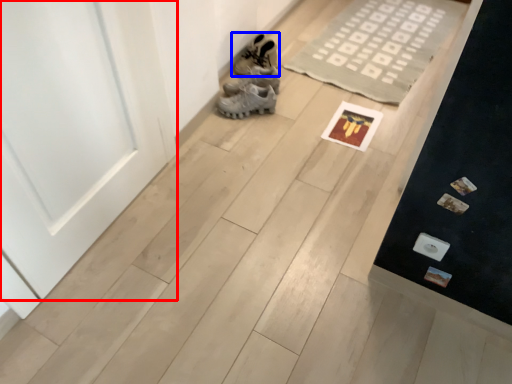
Question: Which point is further to the camera, door (highlighted by a red box) or footwear (highlighted by a blue box)?

Choices:
 (A) door
 (B) footwear

Answer: (B)